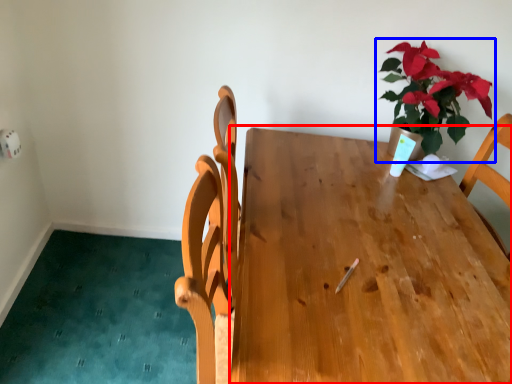
Question: Which object is closer to the camera taking this photo, table (highlighted by a red box) or houseplant (highlighted by a blue box)?

Choices:
 (A) table
 (B) houseplant

Answer: (A)